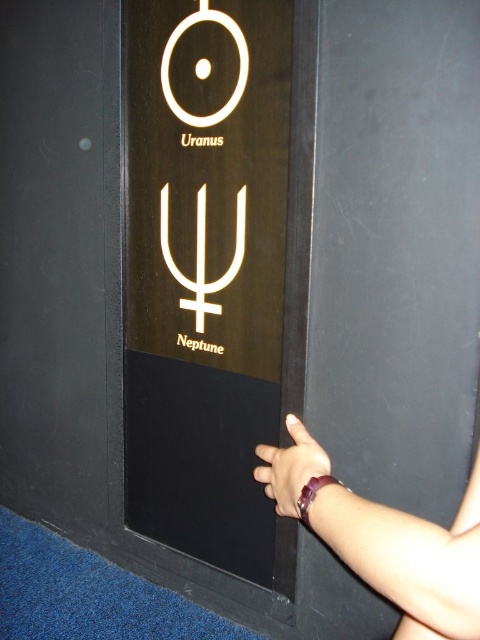
Measure the distance between point (238,224) and camera.

They are 1.16 meters apart.

Between white glossy trident at center and purple fabric wristband at lower center, which one is positioned lower?

purple fabric wristband at lower center is lower down.

Locate an element on the screen. The image size is (480, 640). white glossy trident at center is located at coordinates click(x=203, y=256).

Does purple fabric wristband at lower center appear on the right side of white circle at upper left?

Indeed, purple fabric wristband at lower center is positioned on the right side of white circle at upper left.

Does purple fabric wristband at lower center have a larger size compared to white circle at upper left?

No.

Does point (312, 458) lie behind point (169, 36)?

No, (312, 458) is in front of (169, 36).

This screenshot has width=480, height=640. What are the coordinates of `purple fabric wristband at lower center` in the screenshot? It's located at (289, 467).

Does point (196, 220) come farther from viewer compared to point (162, 56)?

No, (196, 220) is closer to viewer.

What do you see at coordinates (203, 256) in the screenshot? This screenshot has width=480, height=640. I see `white glossy trident at center` at bounding box center [203, 256].

Identify the location of white glossy trident at center. The width and height of the screenshot is (480, 640). (203, 256).